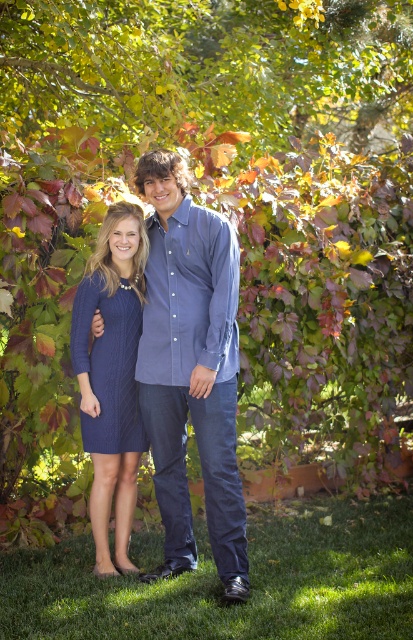
Is green grass at lower center to the right of navy cable-knit dress at center from the viewer's perspective?

Correct, you'll find green grass at lower center to the right of navy cable-knit dress at center.

Is point (382, 628) closer to camera compared to point (121, 353)?

Yes.

Where is `green grass at lower center`? green grass at lower center is located at coordinates (220, 586).

Locate an element on the screen. green grass at lower center is located at coordinates (220, 586).

Which is in front, point (192, 620) or point (151, 298)?

Point (192, 620)

Is point (344, 589) farther from viewer compared to point (175, 552)?

No, (344, 589) is closer to viewer.

I want to click on green grass at lower center, so click(x=220, y=586).

Is point (171, 291) positioned after point (80, 330)?

No, (171, 291) is closer to viewer.

Identify the location of blue textured dress at center. This screenshot has height=640, width=413. (192, 369).

Between point (204, 337) and point (128, 243), which one is positioned behind?

Positioned behind is point (128, 243).

Where is `blue textured dress at center`? The height and width of the screenshot is (640, 413). blue textured dress at center is located at coordinates (192, 369).